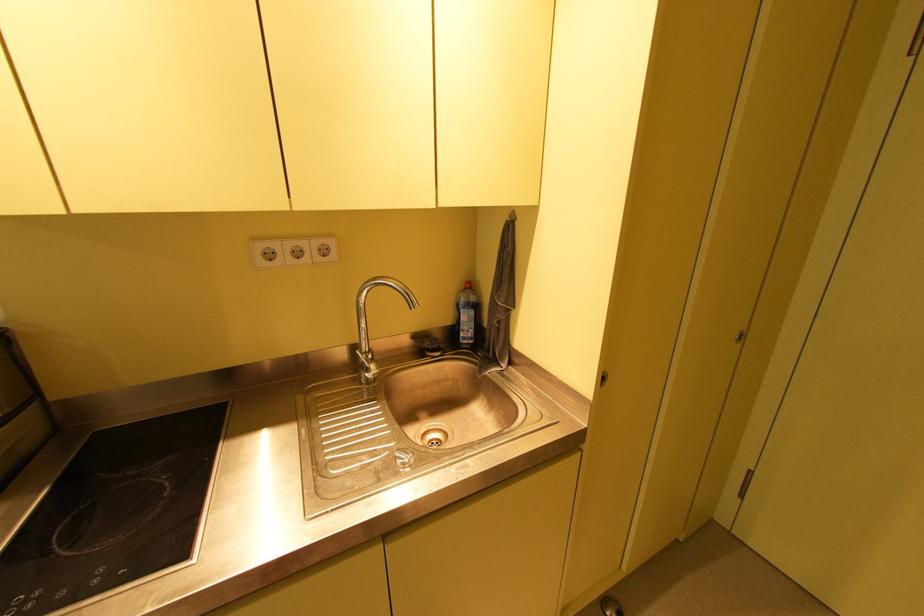
Identify the location of blue dish soap bottle. This screenshot has width=924, height=616. (467, 317).